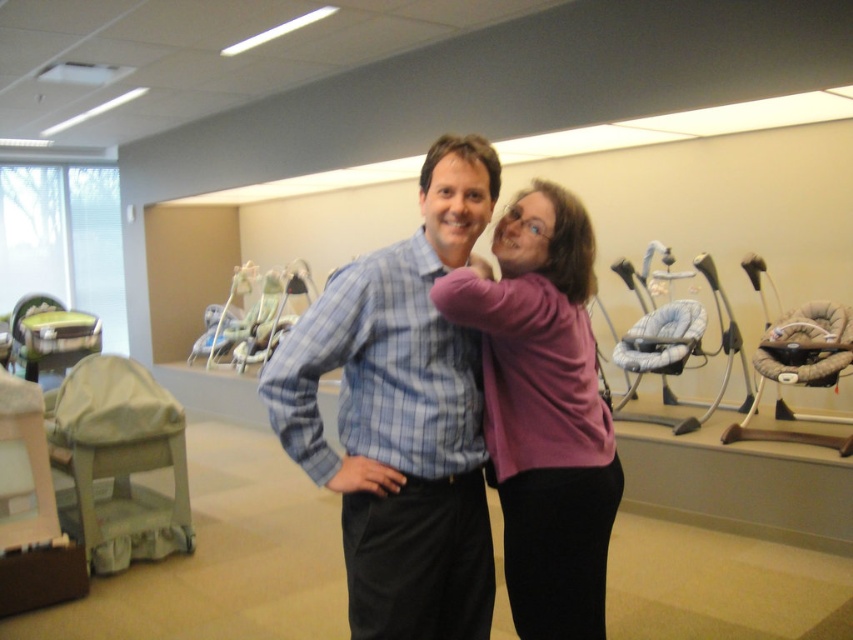
You are a store employee arranging items in the baby equipment store. You need to place the blue plaid shirt at center and the purple sweater at center on a shelf. According to the image, which item should be placed on top of the other?

The blue plaid shirt at center should be placed on top of the purple sweater at center because it is positioned over the purple sweater at center in the image.

You are standing at the point closest to the camera in the image. There are two points marked in the image, one at coordinates point (425, 220) and another at point (566, 364). Which of these points is farther away from you?

Point (425, 220) is behind point (566, 364), so the point farther away from you is point (425, 220).